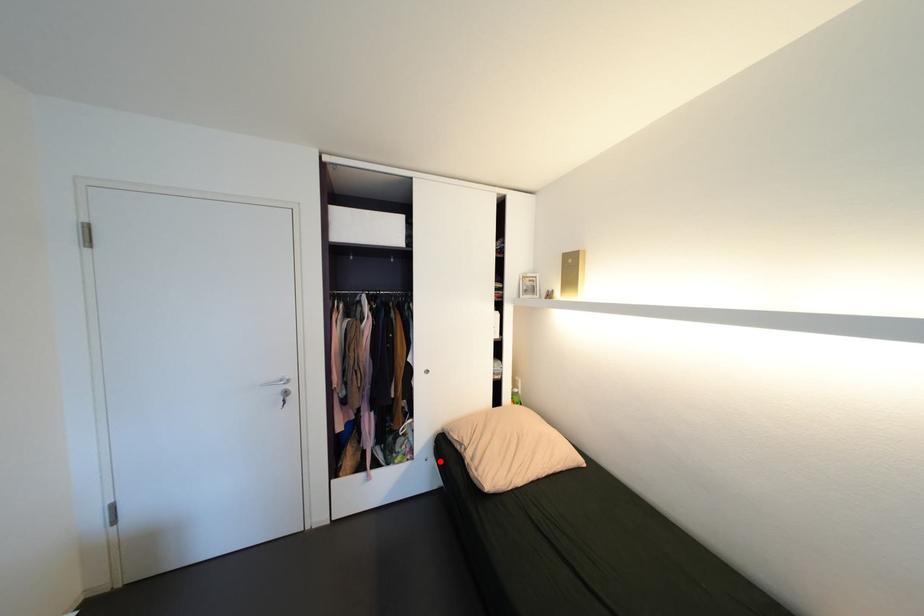
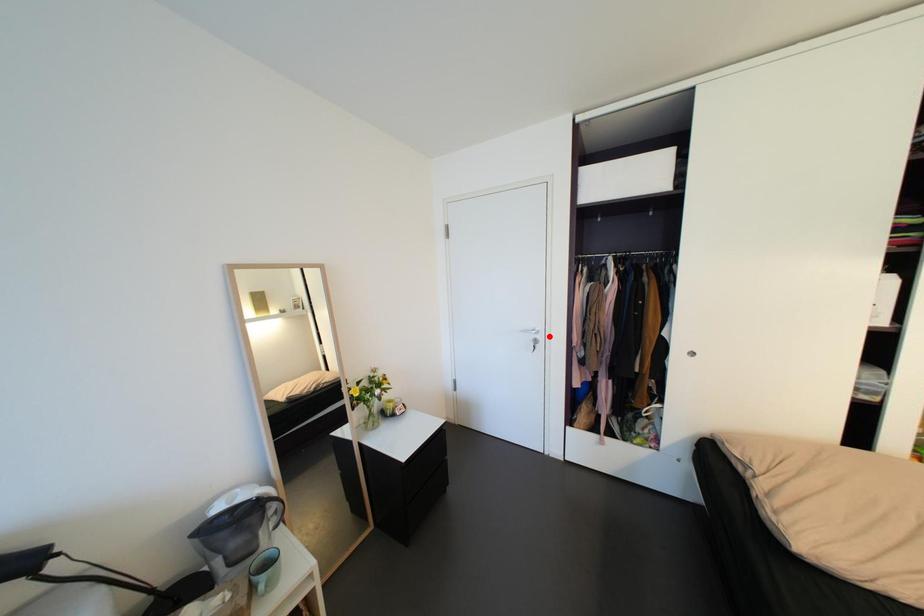
I am providing you with two images of the same scene from different viewpoints. A red point is marked on the first image and another point is marked on the second image. Is the marked point in image1 the same physical position as the marked point in image2?

No